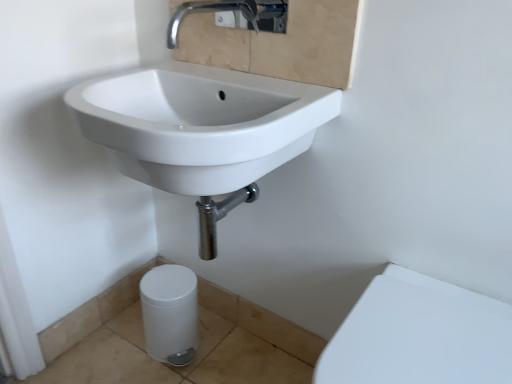
Question: Is chrome metallic faucet at upper center smaller than white glossy sink at upper left?

Choices:
 (A) no
 (B) yes

Answer: (B)

Question: From a real-world perspective, does chrome metallic faucet at upper center sit lower than white glossy sink at upper left?

Choices:
 (A) no
 (B) yes

Answer: (A)

Question: From the image's perspective, is chrome metallic faucet at upper center under white glossy sink at upper left?

Choices:
 (A) no
 (B) yes

Answer: (A)

Question: Considering the relative sizes of chrome metallic faucet at upper center and white glossy sink at upper left in the image provided, is chrome metallic faucet at upper center wider than white glossy sink at upper left?

Choices:
 (A) yes
 (B) no

Answer: (B)

Question: Considering the relative sizes of chrome metallic faucet at upper center and white glossy sink at upper left in the image provided, is chrome metallic faucet at upper center taller than white glossy sink at upper left?

Choices:
 (A) yes
 (B) no

Answer: (B)

Question: Could you tell me if chrome metallic faucet at upper center is facing white glossy sink at upper left?

Choices:
 (A) no
 (B) yes

Answer: (A)

Question: Is the position of white glossy porcelain at lower right, arranged as the 2th porcelain when viewed from the left, more distant than that of white glossy sink at upper left?

Choices:
 (A) no
 (B) yes

Answer: (A)

Question: From the image's perspective, is white glossy porcelain at lower right, arranged as the 2th porcelain when viewed from the left, beneath white glossy sink at upper left?

Choices:
 (A) yes
 (B) no

Answer: (A)

Question: Is white glossy porcelain at lower right, which is the first porcelain in right-to-left order, not within white glossy sink at upper left?

Choices:
 (A) yes
 (B) no

Answer: (A)

Question: Is white glossy porcelain at lower right, arranged as the 2th porcelain when viewed from the left, positioned with its back to white glossy sink at upper left?

Choices:
 (A) yes
 (B) no

Answer: (B)

Question: Is white glossy sink at upper left completely or partially inside white glossy porcelain at lower right, which is the first porcelain in right-to-left order?

Choices:
 (A) no
 (B) yes

Answer: (A)

Question: Is white glossy porcelain at lower right, the second porcelain positioned from the back, taller than white glossy sink at upper left?

Choices:
 (A) no
 (B) yes

Answer: (B)

Question: Is white glossy trash can at lower left, positioned as the 2th porcelain in right-to-left order, wider than chrome metallic faucet at upper center?

Choices:
 (A) yes
 (B) no

Answer: (B)